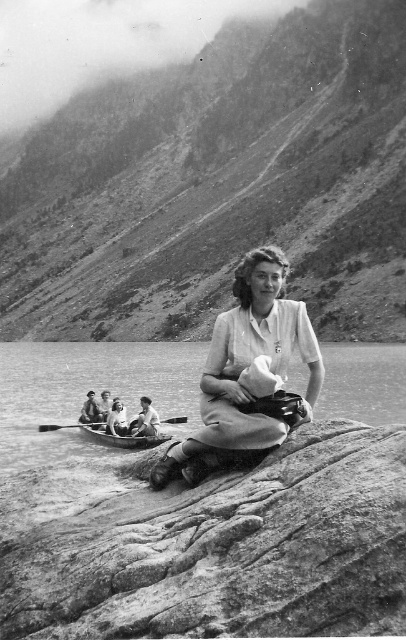
Does smooth skin person at center appear on the right side of wooden paddle at center?

Yes, smooth skin person at center is to the right of wooden paddle at center.

Is smooth skin person at center wider than wooden paddle at center?

Incorrect, smooth skin person at center's width does not surpass wooden paddle at center's.

Is point (114, 426) more distant than point (69, 424)?

No, (114, 426) is closer to viewer.

Find the location of a particular element. smooth skin person at center is located at coordinates (116, 419).

Does smooth skin person at center have a greater width compared to smooth leather jacket at lower left?

Incorrect, smooth skin person at center's width does not surpass smooth leather jacket at lower left's.

Looking at this image, who is more forward, (118, 429) or (82, 420)?

Point (118, 429) is more forward.

Identify the location of smooth skin person at center. (116, 419).

Is wooden canoe at center above smooth fabric shirt at center?

No, wooden canoe at center is not above smooth fabric shirt at center.

Is wooden canoe at center taller than smooth fabric shirt at center?

No, wooden canoe at center is not taller than smooth fabric shirt at center.

Between point (94, 435) and point (131, 429), which one is positioned in front?

Point (131, 429) is more forward.

Find the location of `wooden canoe at center`. wooden canoe at center is located at coordinates (120, 436).